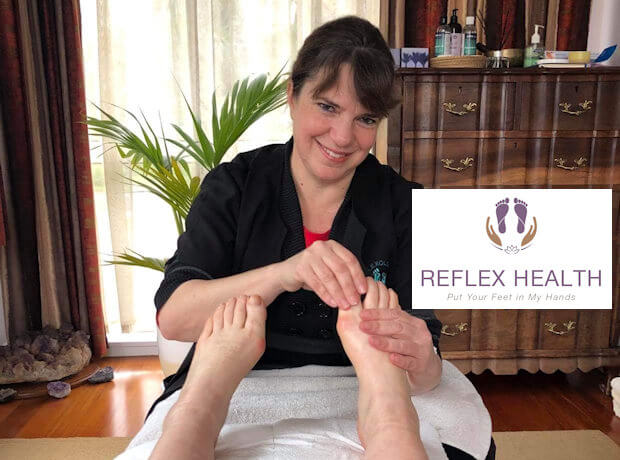
This screenshot has width=620, height=460. I want to click on curtain, so click(211, 41).